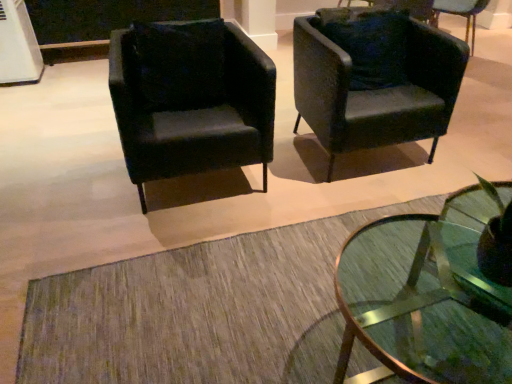
Question: From the image's perspective, is velvet dark green pillow at center positioned above or below velvet black armchair at upper right, arranged as the third chair when viewed from the left?

Choices:
 (A) below
 (B) above

Answer: (A)

Question: From a real-world perspective, is velvet dark green pillow at center above or below velvet black armchair at upper right, arranged as the third chair when viewed from the left?

Choices:
 (A) below
 (B) above

Answer: (B)

Question: Considering the real-world distances, which object is farthest from the clear glass coffee table at lower center?

Choices:
 (A) matte black armchair at upper right, which ranks as the 2th chair in left-to-right order
 (B) velvet dark green pillow at center
 (C) velvet black armchair at upper right, positioned as the first chair in right-to-left order
 (D) matte black armchair at left, which is counted as the 3th chair, starting from the right

Answer: (C)

Question: Which of these objects is positioned farthest from the matte black armchair at left, which is counted as the 3th chair, starting from the right?

Choices:
 (A) velvet black armchair at upper right, arranged as the third chair when viewed from the left
 (B) matte black armchair at upper right, which ranks as the 2th chair in left-to-right order
 (C) velvet dark green pillow at center
 (D) clear glass coffee table at lower center

Answer: (A)